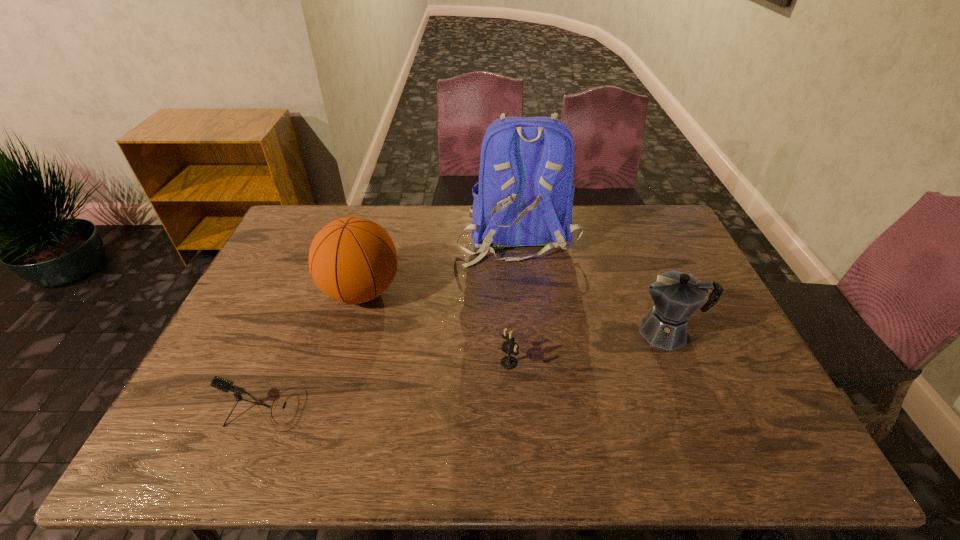
Identify the location of vacant space situated at the spout of the coffeepot. (575, 332).

Locate an element on the screen. This screenshot has height=540, width=960. free space located 0.360m on the back of the candle holder is located at coordinates (503, 264).

At what (x,y) coordinates should I click in order to perform the action: click on free space located on the stand of the microphone. Please return your answer as a coordinate pair (x, y). This screenshot has height=540, width=960. Looking at the image, I should click on (453, 409).

Locate an element on the screen. This screenshot has width=960, height=540. object present at the far edge is located at coordinates (524, 197).

The image size is (960, 540). What are the coordinates of `object located in the near edge section of the desktop` in the screenshot? It's located at (225, 385).

I want to click on object that is at the left edge, so click(x=225, y=385).

Where is `object at the right edge`? object at the right edge is located at coordinates (676, 295).

Locate an element on the screen. This screenshot has width=960, height=540. object at the near left corner is located at coordinates (225, 385).

Image resolution: width=960 pixels, height=540 pixels. Find the location of `free space at the far edge of the desktop`. free space at the far edge of the desktop is located at coordinates (452, 206).

Where is `vacant space at the near edge of the desktop`? vacant space at the near edge of the desktop is located at coordinates (425, 464).